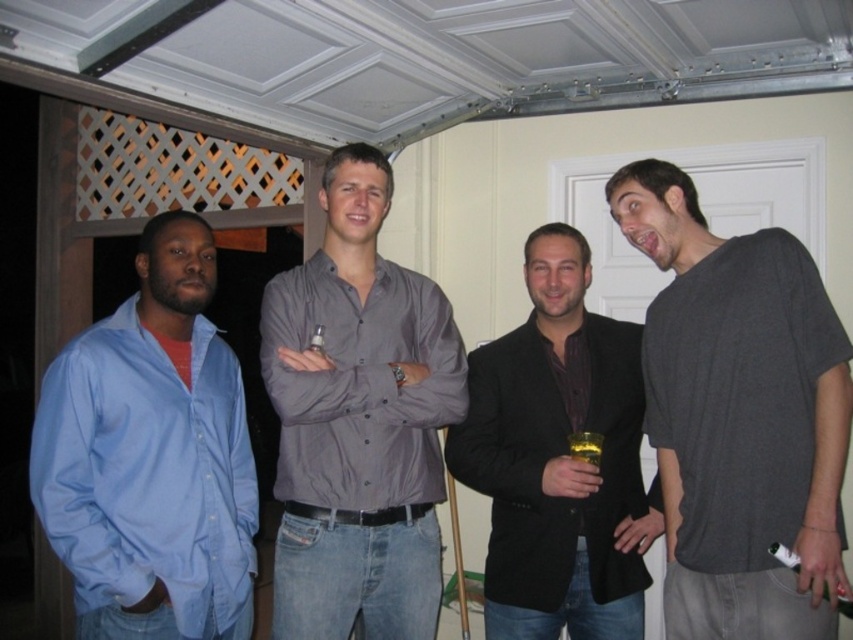
Question: Does blue cotton shirt at left lie behind green plastic bottle at lower right?

Choices:
 (A) no
 (B) yes

Answer: (A)

Question: Which of these objects is positioned farthest from the green plastic bottle at lower right?

Choices:
 (A) translucent glass bottle at center
 (B) blue cotton shirt at left

Answer: (B)

Question: Among these objects, which one is nearest to the camera?

Choices:
 (A) black matte blazer at center
 (B) gray cotton t-shirt at right
 (C) translucent glass bottle at center
 (D) green plastic bottle at lower right

Answer: (B)

Question: Does black matte blazer at center have a lesser width compared to translucent glass cup at center?

Choices:
 (A) yes
 (B) no

Answer: (B)

Question: Does gray cotton t-shirt at right have a greater width compared to black matte blazer at center?

Choices:
 (A) no
 (B) yes

Answer: (A)

Question: Among these points, which one is farthest from the camera?

Choices:
 (A) (596, 467)
 (B) (589, 256)
 (C) (157, 561)

Answer: (B)